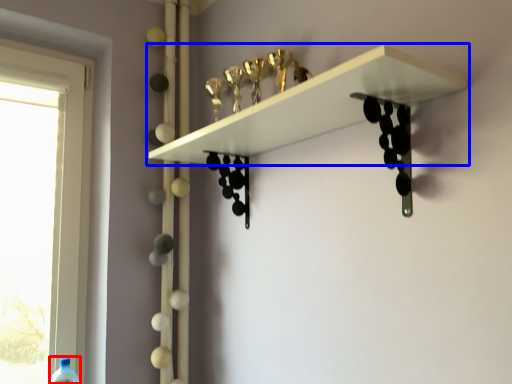
Question: Which object is closer to the camera taking this photo, wine bottle (highlighted by a red box) or shelf (highlighted by a blue box)?

Choices:
 (A) wine bottle
 (B) shelf

Answer: (B)